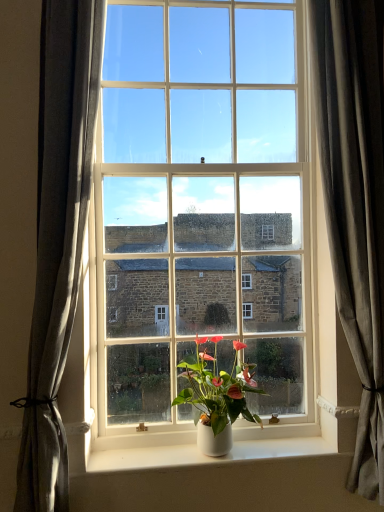
Question: From a real-world perspective, is white glossy window at center above or below white glossy pot at center?

Choices:
 (A) above
 (B) below

Answer: (A)

Question: Considering the positions of white glossy window at center and white glossy pot at center in the image, is white glossy window at center taller or shorter than white glossy pot at center?

Choices:
 (A) short
 (B) tall

Answer: (B)

Question: Estimate the real-world distances between objects in this image. Which object is closer to the white matte window sill at center?

Choices:
 (A) gray fabric curtain at right, marked as the second curtain in a left-to-right arrangement
 (B) white glossy pot at center
 (C) white glossy window at center
 (D) gray fabric curtain at left, the first curtain positioned from the left

Answer: (B)

Question: Which is farther from the white glossy window at center?

Choices:
 (A) gray fabric curtain at right, which appears as the 1th curtain when viewed from the right
 (B) white matte window sill at center
 (C) gray fabric curtain at left, the second curtain in the right-to-left sequence
 (D) white glossy pot at center

Answer: (B)